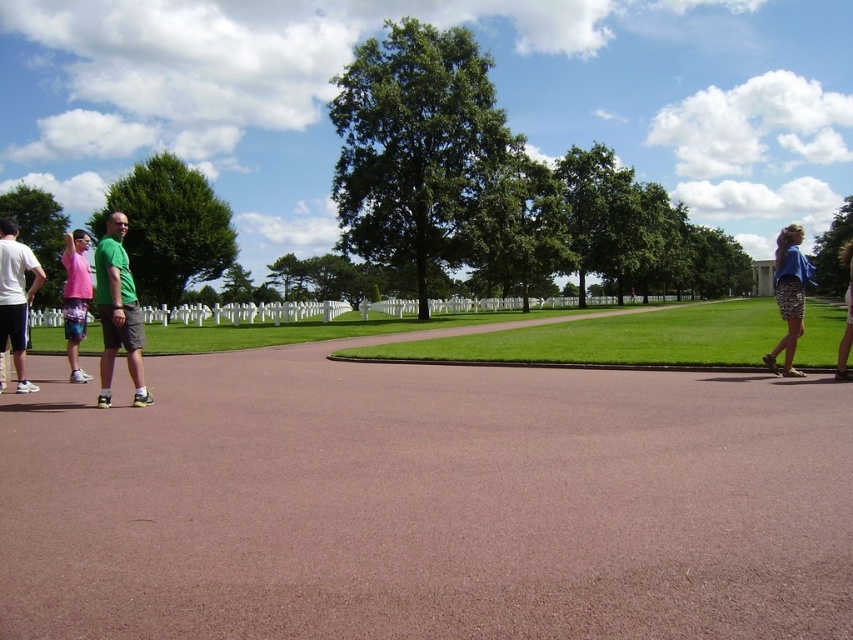
Is brown asphalt path at center shorter than matte blue dress at right?

Yes, brown asphalt path at center is shorter than matte blue dress at right.

Who is positioned more to the left, brown asphalt path at center or matte blue dress at right?

Positioned to the left is brown asphalt path at center.

This screenshot has height=640, width=853. Identify the location of brown asphalt path at center. (425, 502).

Can you confirm if white matte shorts at left is wider than matte blue dress at right?

No.

Is point (3, 332) farther from viewer compared to point (846, 314)?

That is False.

Who is more forward, [33,262] or [846,296]?

Point [33,262] is in front.

Locate an element on the screen. Image resolution: width=853 pixels, height=640 pixels. white matte shorts at left is located at coordinates point(15,298).

Which of these two, white matte shorts at left or blue printed skirt at right, stands shorter?

Standing shorter between the two is white matte shorts at left.

Does white matte shorts at left appear on the left side of blue printed skirt at right?

Indeed, white matte shorts at left is positioned on the left side of blue printed skirt at right.

Measure the distance between white matte shorts at left and camera.

The distance of white matte shorts at left from camera is 8.97 meters.

Locate an element on the screen. The width and height of the screenshot is (853, 640). white matte shorts at left is located at coordinates (15, 298).